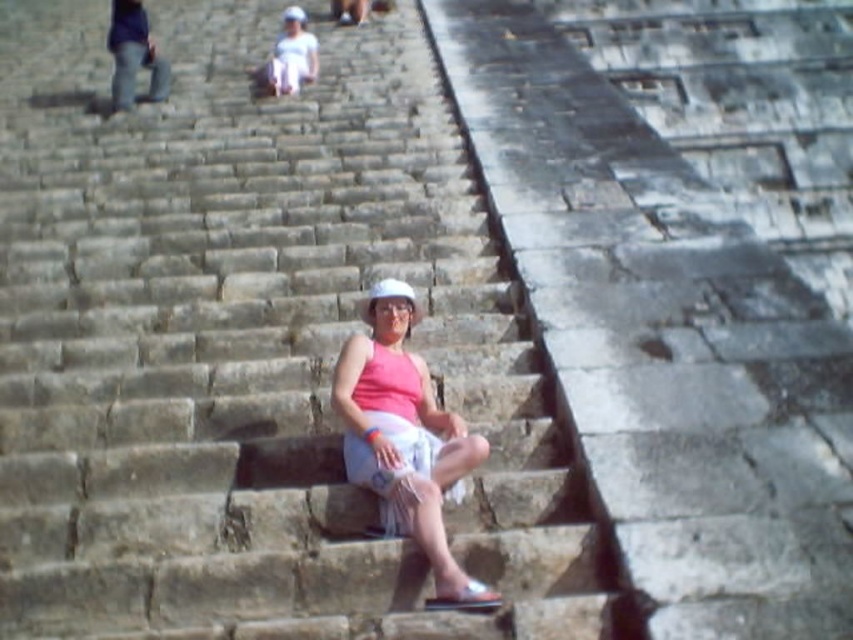
Question: Which point is farther from the camera taking this photo?

Choices:
 (A) (438, 493)
 (B) (67, 38)

Answer: (B)

Question: Where is stone stairs at center located in relation to pink fabric at center in the image?

Choices:
 (A) left
 (B) right

Answer: (A)

Question: Does stone stairs at center appear under pink fabric at center?

Choices:
 (A) no
 (B) yes

Answer: (A)

Question: Can you confirm if stone stairs at center is positioned to the left of pink fabric at center?

Choices:
 (A) no
 (B) yes

Answer: (B)